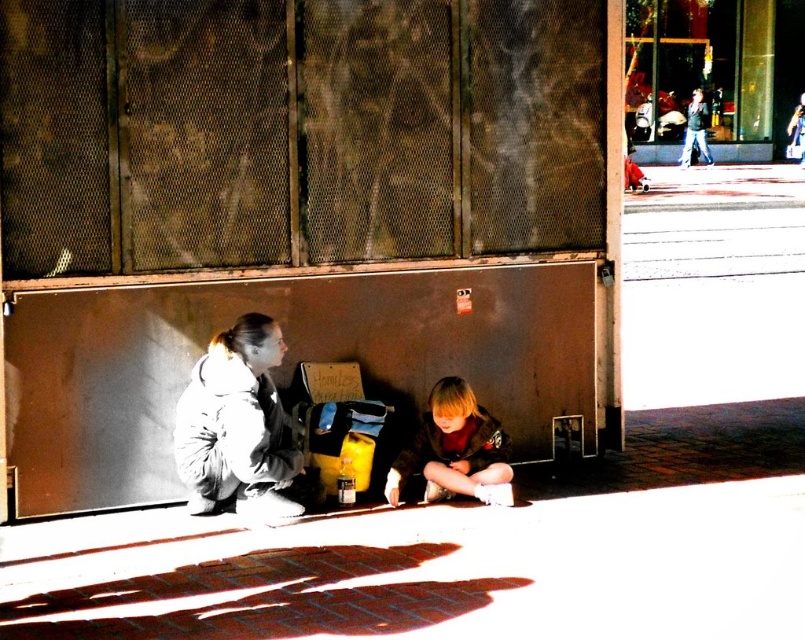
You are a photographer trying to capture the white fleece jacket at lower left in the scene. Based on the coordinates provided, where should you position your camera to ensure it is centered in your shot?

The white fleece jacket at lower left is located at point (237, 426), so you should position your camera to center on those coordinates to capture it.

Looking at this image, you are a photographer standing at the center of the scene. You want to take a photo that includes both the white fleece jacket at lower left and the dark gray jacket at upper right in the same frame. Given the distance between them, do you think you can capture both in one shot without moving your position?

The white fleece jacket at lower left and dark gray jacket at upper right are 24.59 meters apart from each other. Depending on the lens used, a wide angle lens would be necessary to capture both subjects in one frame without moving your position.

You are a photographer trying to capture both the white fleece jacket at lower left and the dark gray jacket at upper right in the same frame. Based on their positions, which jacket will appear closer to the bottom edge of your photo?

The white fleece jacket at lower left is below the dark gray jacket at upper right, so it will appear closer to the bottom edge of the photo.